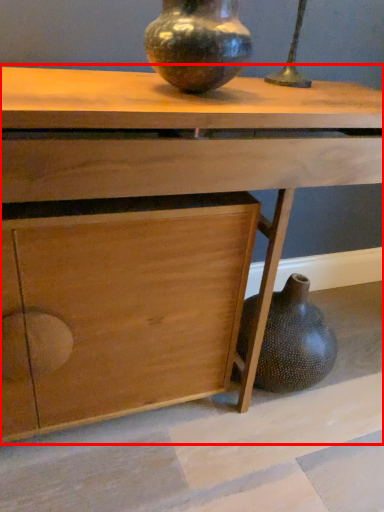
Question: From the image's perspective, considering the relative positions of table (annotated by the red box) and vase in the image provided, where is table (annotated by the red box) located with respect to the staircase?

Choices:
 (A) above
 (B) below

Answer: (B)